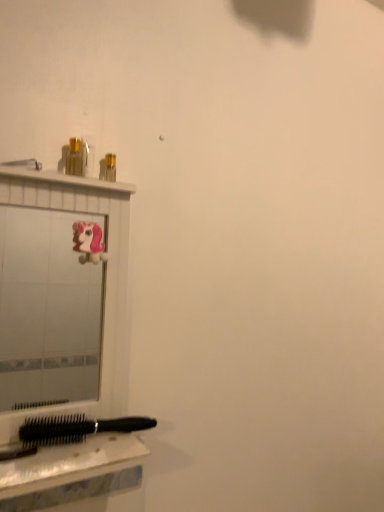
Question: From the image's perspective, would you say white glossy mirror at upper left is shown under matte white shower at upper left?

Choices:
 (A) no
 (B) yes

Answer: (B)

Question: Is white glossy mirror at upper left not within matte white shower at upper left?

Choices:
 (A) no
 (B) yes

Answer: (B)

Question: From a real-world perspective, is white glossy mirror at upper left located beneath matte white shower at upper left?

Choices:
 (A) no
 (B) yes

Answer: (B)

Question: Is there a large distance between white glossy mirror at upper left and matte white shower at upper left?

Choices:
 (A) no
 (B) yes

Answer: (B)

Question: Does white glossy mirror at upper left have a larger size compared to matte white shower at upper left?

Choices:
 (A) no
 (B) yes

Answer: (B)

Question: Is white glossy mirror at upper left oriented towards matte white shower at upper left?

Choices:
 (A) no
 (B) yes

Answer: (A)

Question: Can you confirm if metallic gold toiletry at upper left is positioned to the right of matte white shower at upper left?

Choices:
 (A) yes
 (B) no

Answer: (A)

Question: Considering the relative sizes of metallic gold toiletry at upper left and matte white shower at upper left in the image provided, is metallic gold toiletry at upper left shorter than matte white shower at upper left?

Choices:
 (A) yes
 (B) no

Answer: (B)

Question: Is metallic gold toiletry at upper left bigger than matte white shower at upper left?

Choices:
 (A) yes
 (B) no

Answer: (A)

Question: Is metallic gold toiletry at upper left next to matte white shower at upper left and touching it?

Choices:
 (A) yes
 (B) no

Answer: (A)

Question: Is metallic gold toiletry at upper left smaller than matte white shower at upper left?

Choices:
 (A) no
 (B) yes

Answer: (A)

Question: Is metallic gold toiletry at upper left located outside matte white shower at upper left?

Choices:
 (A) no
 (B) yes

Answer: (B)

Question: Is white glossy mirror at upper left closer to the viewer compared to black plastic hairbrush at lower left?

Choices:
 (A) no
 (B) yes

Answer: (A)